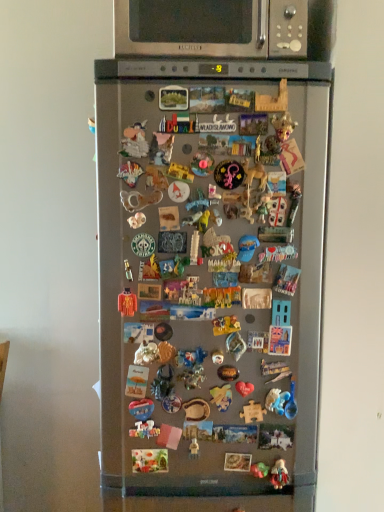
Question: From the image's perspective, is orange fabric toy at center, which is counted as the first toy, starting from the left, over metallic gold figurine at center, the 3th toy when ordered from top to bottom?

Choices:
 (A) yes
 (B) no

Answer: (A)

Question: From a real-world perspective, is orange fabric toy at center, the 4th toy viewed from the right, over metallic gold figurine at center, the 3th toy when ordered from top to bottom?

Choices:
 (A) no
 (B) yes

Answer: (B)

Question: Considering the relative positions of orange fabric toy at center, arranged as the 4th toy when ordered from the bottom, and metallic gold figurine at center, the 2th toy in the bottom-to-top sequence, in the image provided, is orange fabric toy at center, arranged as the 4th toy when ordered from the bottom, to the right of metallic gold figurine at center, the 2th toy in the bottom-to-top sequence, from the viewer's perspective?

Choices:
 (A) no
 (B) yes

Answer: (A)

Question: Is orange fabric toy at center, which ranks as the first toy in top-to-bottom order, placed right next to metallic gold figurine at center, the 2th toy in the bottom-to-top sequence?

Choices:
 (A) yes
 (B) no

Answer: (B)

Question: Does orange fabric toy at center, which is counted as the first toy, starting from the left, have a smaller size compared to metallic gold figurine at center, which is counted as the second toy, starting from the left?

Choices:
 (A) no
 (B) yes

Answer: (A)

Question: Considering the positions of satin silver fridge at center and metallic gold figurine at center, which is counted as the second toy, starting from the left, in the image, is satin silver fridge at center taller or shorter than metallic gold figurine at center, which is counted as the second toy, starting from the left,?

Choices:
 (A) short
 (B) tall

Answer: (B)

Question: From the image's perspective, is satin silver fridge at center above or below metallic gold figurine at center, the 2th toy in the bottom-to-top sequence?

Choices:
 (A) above
 (B) below

Answer: (A)

Question: Would you say satin silver fridge at center is to the left or to the right of metallic gold figurine at center, the 3th toy when ordered from right to left, in the picture?

Choices:
 (A) left
 (B) right

Answer: (B)

Question: Does point (254, 185) appear closer or farther from the camera than point (190, 443)?

Choices:
 (A) closer
 (B) farther

Answer: (A)

Question: Is matte plastic figurine at lower center, arranged as the first toy when viewed from the right, spatially inside metallic gold figurine at center, the 3th toy when ordered from top to bottom, or outside of it?

Choices:
 (A) inside
 (B) outside

Answer: (B)

Question: In terms of height, does matte plastic figurine at lower center, arranged as the first toy when viewed from the right, look taller or shorter compared to metallic gold figurine at center, the 2th toy in the bottom-to-top sequence?

Choices:
 (A) short
 (B) tall

Answer: (B)

Question: Is matte plastic figurine at lower center, arranged as the first toy when viewed from the right, wider or thinner than metallic gold figurine at center, the 2th toy in the bottom-to-top sequence?

Choices:
 (A) wide
 (B) thin

Answer: (B)

Question: Looking at the image, does matte plastic figurine at lower center, arranged as the first toy when viewed from the right, seem bigger or smaller compared to metallic gold figurine at center, which is counted as the second toy, starting from the left?

Choices:
 (A) small
 (B) big

Answer: (B)

Question: Based on their positions, is satin silver microwave at upper center located to the left or right of orange fabric toy at center, arranged as the 4th toy when ordered from the bottom?

Choices:
 (A) left
 (B) right

Answer: (B)

Question: In terms of height, does satin silver microwave at upper center look taller or shorter compared to orange fabric toy at center, arranged as the 4th toy when ordered from the bottom?

Choices:
 (A) short
 (B) tall

Answer: (B)